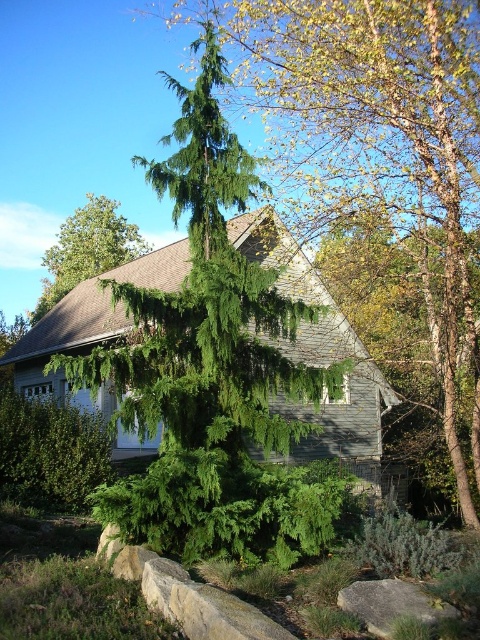
Is gray wood cottage at center bigger than green textured evergreen tree at upper center?

Yes, gray wood cottage at center is bigger than green textured evergreen tree at upper center.

Who is higher up, gray wood cottage at center or green textured evergreen tree at upper center?

green textured evergreen tree at upper center is above.

Who is more distant from viewer, (330,406) or (63,280)?

The point (63,280) is behind.

The image size is (480, 640). I want to click on gray wood cottage at center, so point(324,358).

Is point (356, 52) closer to viewer compared to point (367, 480)?

Yes, point (356, 52) is in front of point (367, 480).

Who is positioned more to the right, green needle-like at center or gray wood cottage at center?

Positioned to the right is green needle-like at center.

Does point (266, 81) lie behind point (268, 260)?

Yes, point (266, 81) is farther from viewer.

Find the location of a particular element. Image resolution: width=480 pixels, height=640 pixels. green needle-like at center is located at coordinates (377, 145).

Is point (420, 205) farther from camera compared to point (388, 593)?

Yes, it is.

Is green needle-like at center below gray/rough rock at lower center?

Incorrect, green needle-like at center is not positioned below gray/rough rock at lower center.

Is point (259, 3) farther from camera compared to point (387, 586)?

Yes, it is behind point (387, 586).

Locate an element on the screen. The height and width of the screenshot is (640, 480). green needle-like at center is located at coordinates (377, 145).